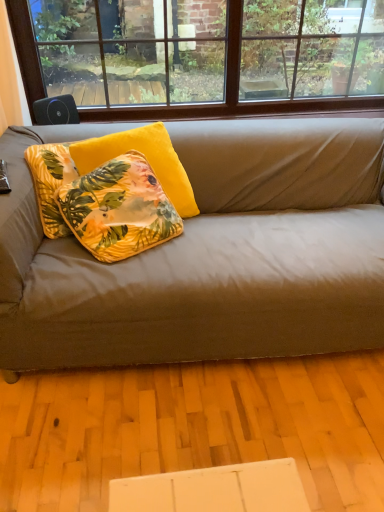
Question: Is yellow velvet pillow at center, placed as the 2th pillow when sorted from front to back, not inside floral yellow pillow at center, which ranks as the 1th pillow in front-to-back order?

Choices:
 (A) yes
 (B) no

Answer: (A)

Question: Considering the relative positions of yellow velvet pillow at center, placed as the 2th pillow when sorted from front to back, and floral yellow pillow at center, which ranks as the 2th pillow in back-to-front order, in the image provided, is yellow velvet pillow at center, placed as the 2th pillow when sorted from front to back, in front of floral yellow pillow at center, which ranks as the 2th pillow in back-to-front order,?

Choices:
 (A) yes
 (B) no

Answer: (B)

Question: Considering the relative positions of yellow velvet pillow at center, which is counted as the 1th pillow, starting from the back, and floral yellow pillow at center, which ranks as the 1th pillow in front-to-back order, in the image provided, is yellow velvet pillow at center, which is counted as the 1th pillow, starting from the back, to the right of floral yellow pillow at center, which ranks as the 1th pillow in front-to-back order, from the viewer's perspective?

Choices:
 (A) no
 (B) yes

Answer: (B)

Question: From a real-world perspective, is yellow velvet pillow at center, which is counted as the 1th pillow, starting from the back, under floral yellow pillow at center, which ranks as the 2th pillow in back-to-front order?

Choices:
 (A) yes
 (B) no

Answer: (B)

Question: Considering the relative sizes of yellow velvet pillow at center, which is counted as the 1th pillow, starting from the back, and floral yellow pillow at center, which ranks as the 2th pillow in back-to-front order, in the image provided, is yellow velvet pillow at center, which is counted as the 1th pillow, starting from the back, taller than floral yellow pillow at center, which ranks as the 2th pillow in back-to-front order,?

Choices:
 (A) no
 (B) yes

Answer: (B)

Question: From the image's perspective, is yellow velvet pillow at center, which is counted as the 1th pillow, starting from the back, above floral yellow pillow at center, which ranks as the 1th pillow in front-to-back order?

Choices:
 (A) yes
 (B) no

Answer: (A)

Question: Is the depth of yellow velvet pillow at center, placed as the 2th pillow when sorted from front to back, greater than that of brown wood window at upper center?

Choices:
 (A) yes
 (B) no

Answer: (B)

Question: Is brown wood window at upper center inside yellow velvet pillow at center, placed as the 2th pillow when sorted from front to back?

Choices:
 (A) no
 (B) yes

Answer: (A)

Question: Is yellow velvet pillow at center, which is counted as the 1th pillow, starting from the back, shorter than brown wood window at upper center?

Choices:
 (A) yes
 (B) no

Answer: (A)

Question: From a real-world perspective, is yellow velvet pillow at center, which is counted as the 1th pillow, starting from the back, on top of brown wood window at upper center?

Choices:
 (A) yes
 (B) no

Answer: (B)

Question: From the image's perspective, is yellow velvet pillow at center, placed as the 2th pillow when sorted from front to back, beneath brown wood window at upper center?

Choices:
 (A) no
 (B) yes

Answer: (B)

Question: Can you confirm if yellow velvet pillow at center, which is counted as the 1th pillow, starting from the back, is taller than brown wood window at upper center?

Choices:
 (A) no
 (B) yes

Answer: (A)

Question: Does brown wood window at upper center have a greater width compared to floral yellow pillow at center, which ranks as the 1th pillow in front-to-back order?

Choices:
 (A) no
 (B) yes

Answer: (A)